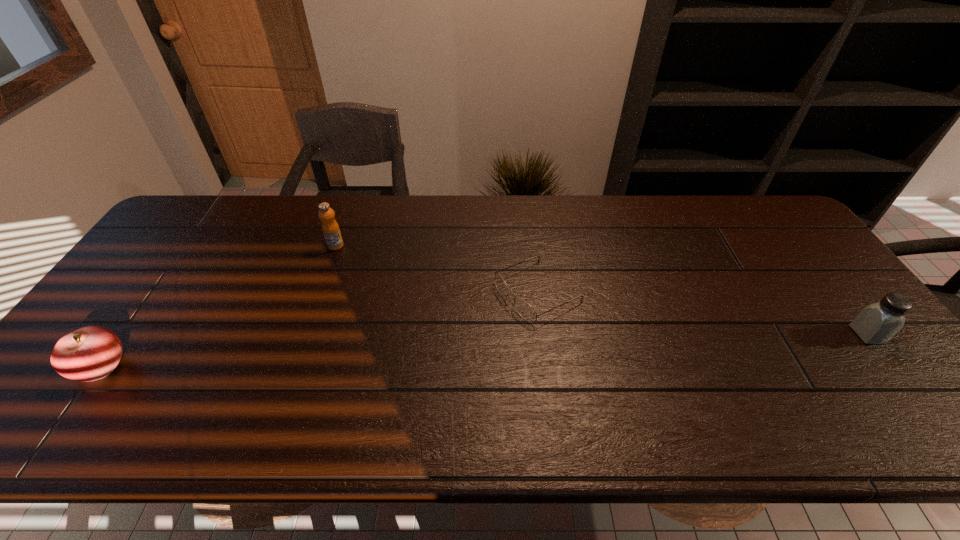
Where is `unoccupied position between the orange juice and the spectacles`? The image size is (960, 540). unoccupied position between the orange juice and the spectacles is located at coordinates (437, 268).

This screenshot has width=960, height=540. What are the coordinates of `vacant region between the apple and the rightmost object` in the screenshot? It's located at (484, 350).

Find the location of a particular element. The image size is (960, 540). free space between the rightmost object and the leftmost object is located at coordinates (484, 350).

Locate an element on the screen. The image size is (960, 540). the closest object to the leftmost object is located at coordinates (330, 228).

Find the location of a particular element. This screenshot has height=540, width=960. object that stands as the closest to the shortest object is located at coordinates (330, 228).

The image size is (960, 540). Identify the location of vacant area in the image that satisfies the following two spatial constraints: 1. on the front side of the spectacles; 2. on the left side of the orange juice. (320, 292).

Locate an element on the screen. The image size is (960, 540). vacant area in the image that satisfies the following two spatial constraints: 1. on the front side of the tallest object; 2. on the right side of the saltshaker is located at coordinates (304, 334).

Locate an element on the screen. This screenshot has width=960, height=540. vacant region that satisfies the following two spatial constraints: 1. on the front side of the tallest object; 2. on the left side of the rightmost object is located at coordinates (304, 334).

The width and height of the screenshot is (960, 540). I want to click on free location that satisfies the following two spatial constraints: 1. on the back side of the rightmost object; 2. on the right side of the leftmost object, so click(x=123, y=334).